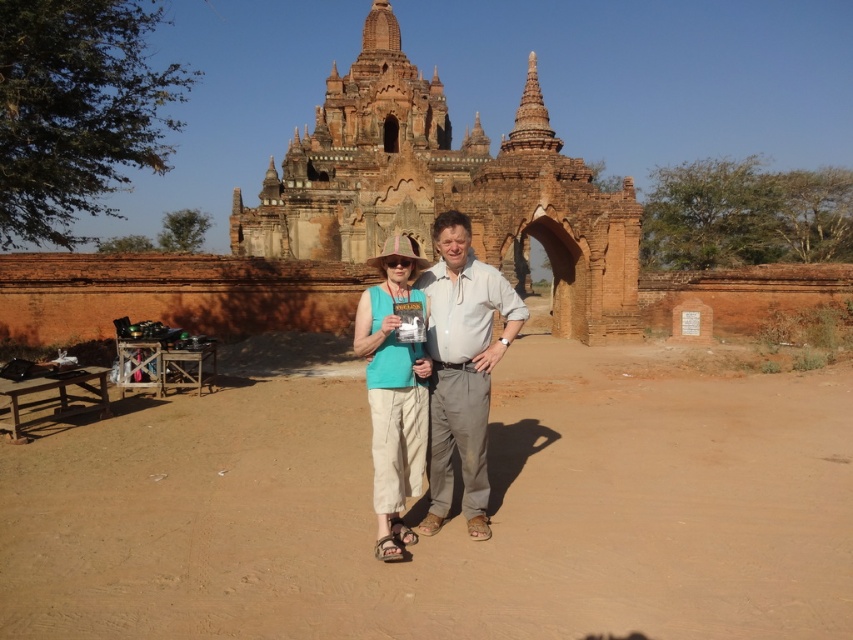
You are a tour guide explaining the temple complex to visitors. You notice two tourists wearing similar clothing items. One is wearing a matte teal tank top at center and the other a matte teal shirt at center. Which clothing item is shorter in length?

The matte teal tank top at center is shorter than the matte teal shirt at center.

You are a tour guide leading a group through the ancient temple complex in Bagan. You notice the brown dirt track at center and the matte teal shirt at center. Which object is closer to the group if they are standing at the entrance of the temple?

The brown dirt track at center is 46.22 feet away from matte teal shirt at center. Since the group is at the temple entrance, the matte teal shirt at center is closer to them because it is positioned in front of the brown dirt track at center.